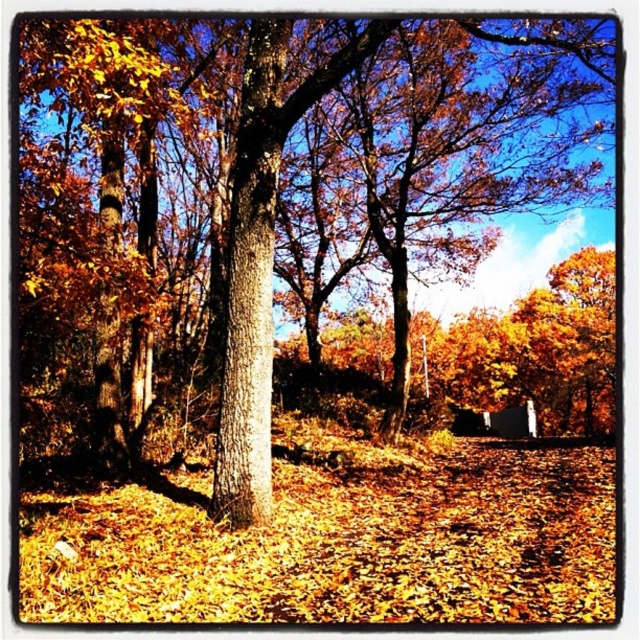
Which of these two, smooth bark tree at center or smooth brown tree trunk at center, stands shorter?

smooth brown tree trunk at center

Does point (250, 172) lie in front of point (250, 52)?

That is True.

Where is `smooth bark tree at center`? smooth bark tree at center is located at coordinates (269, 214).